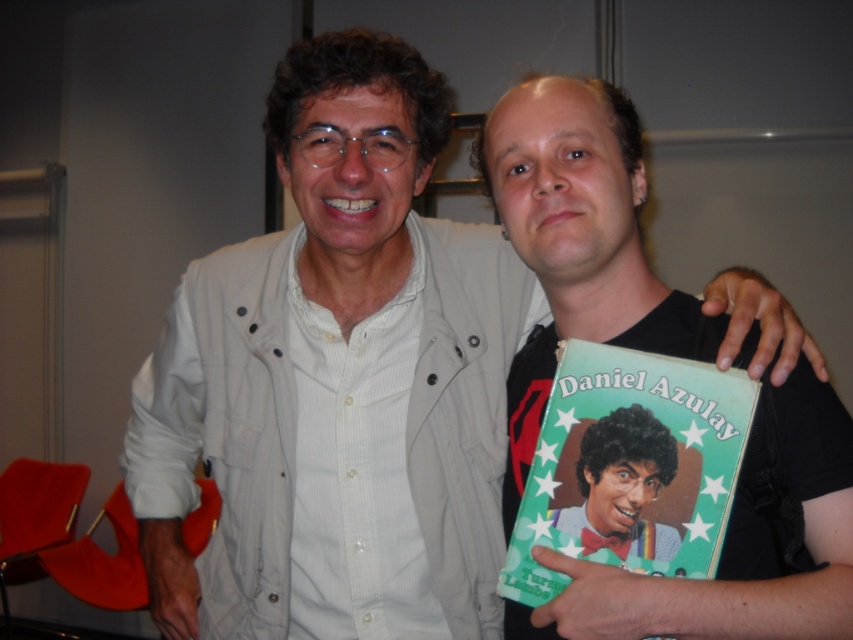
Is black matte book at center taller than green paper book at center?

Correct, black matte book at center is much taller as green paper book at center.

I want to click on black matte book at center, so click(x=576, y=237).

Can you confirm if green paper book at center is positioned below curly-haired man at center?

Actually, green paper book at center is above curly-haired man at center.

Can you confirm if green paper book at center is positioned above curly-haired man at center?

Yes.

This screenshot has width=853, height=640. Describe the element at coordinates (630, 467) in the screenshot. I see `green paper book at center` at that location.

Find the location of a particular element. green paper book at center is located at coordinates (630, 467).

How distant is black matte book at center from curly-haired man at center?

The distance of black matte book at center from curly-haired man at center is 16.65 centimeters.

Does black matte book at center have a smaller size compared to curly-haired man at center?

No.

Who is more forward, (715, 356) or (602, 420)?

Point (602, 420) is more forward.

Image resolution: width=853 pixels, height=640 pixels. What are the coordinates of `black matte book at center` in the screenshot? It's located at (576, 237).